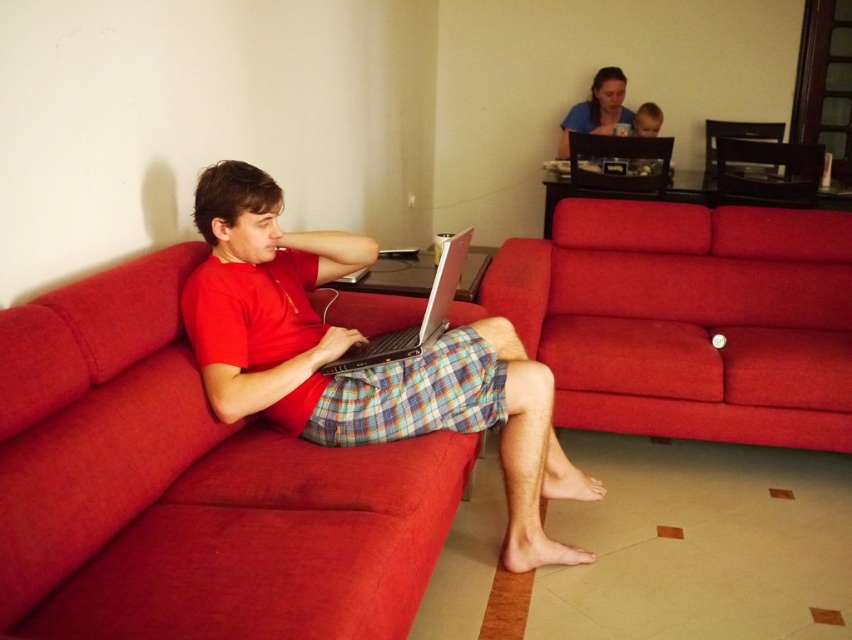
Is velvet red couch at center closer to the viewer compared to matte red shirt at center?

No, it is behind matte red shirt at center.

In the scene shown: Who is taller, velvet red couch at center or matte red shirt at center?

With more height is matte red shirt at center.

What do you see at coordinates (688, 320) in the screenshot? The image size is (852, 640). I see `velvet red couch at center` at bounding box center [688, 320].

Where is `velvet red couch at center`? This screenshot has height=640, width=852. velvet red couch at center is located at coordinates (688, 320).

Who is shorter, matte red shirt at center or plaid fabric laptop at center?

Standing shorter between the two is plaid fabric laptop at center.

Does matte red shirt at center appear over plaid fabric laptop at center?

Indeed, matte red shirt at center is positioned over plaid fabric laptop at center.

Is point (216, 337) positioned behind point (361, 428)?

No, (216, 337) is closer to viewer.

The width and height of the screenshot is (852, 640). Find the location of `matte red shirt at center`. matte red shirt at center is located at coordinates (363, 369).

Is red fabric couch at center positioned before matte red shirt at center?

Yes, it is.

Does red fabric couch at center lie behind matte red shirt at center?

No.

Who is more forward, [200,396] or [517,406]?

Point [200,396]

Image resolution: width=852 pixels, height=640 pixels. I want to click on red fabric couch at center, so click(190, 486).